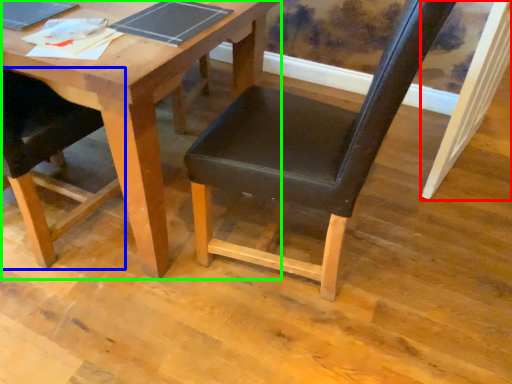
Question: Based on their relative distances, which object is farther from plank (highlighted by a red box)? Choose from chair (highlighted by a blue box) and table (highlighted by a green box).

Choices:
 (A) chair
 (B) table

Answer: (A)